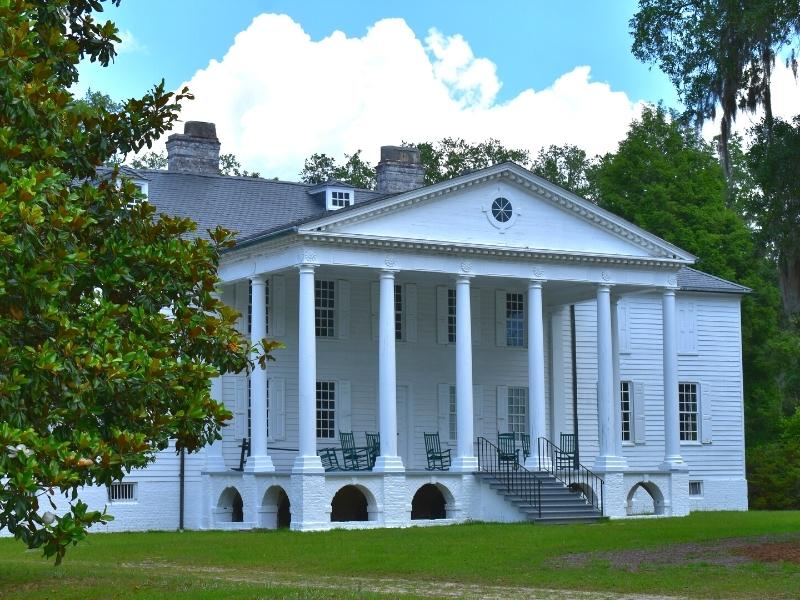
This screenshot has height=600, width=800. Identify the location of attic. (332, 192).